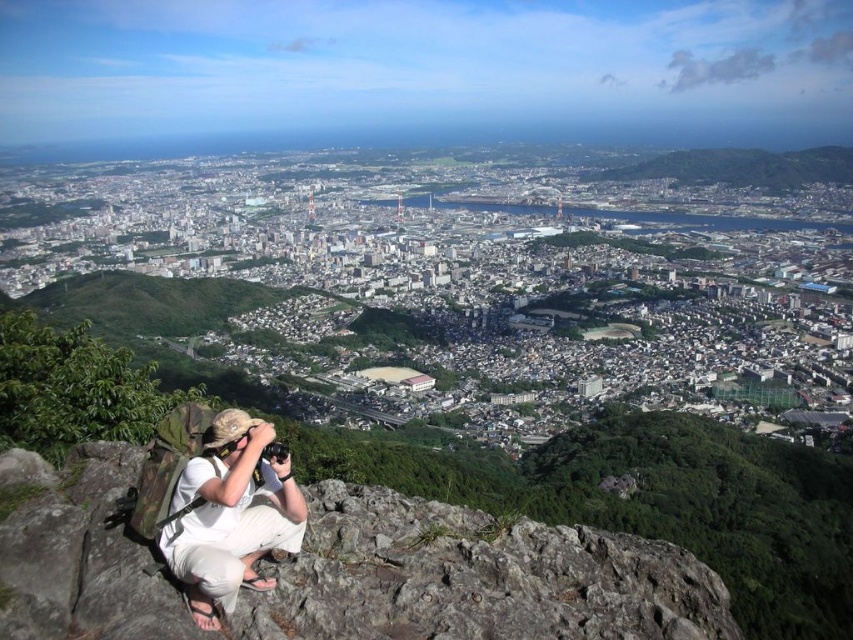
Where is `gray rocky cliff at lower left`? This screenshot has width=853, height=640. gray rocky cliff at lower left is located at coordinates (344, 570).

This screenshot has height=640, width=853. What do you see at coordinates (344, 570) in the screenshot? I see `gray rocky cliff at lower left` at bounding box center [344, 570].

Measure the distance between point (415, 506) and camera.

Point (415, 506) is 615.31 meters away from camera.

Locate an element on the screen. The height and width of the screenshot is (640, 853). gray rocky cliff at lower left is located at coordinates (344, 570).